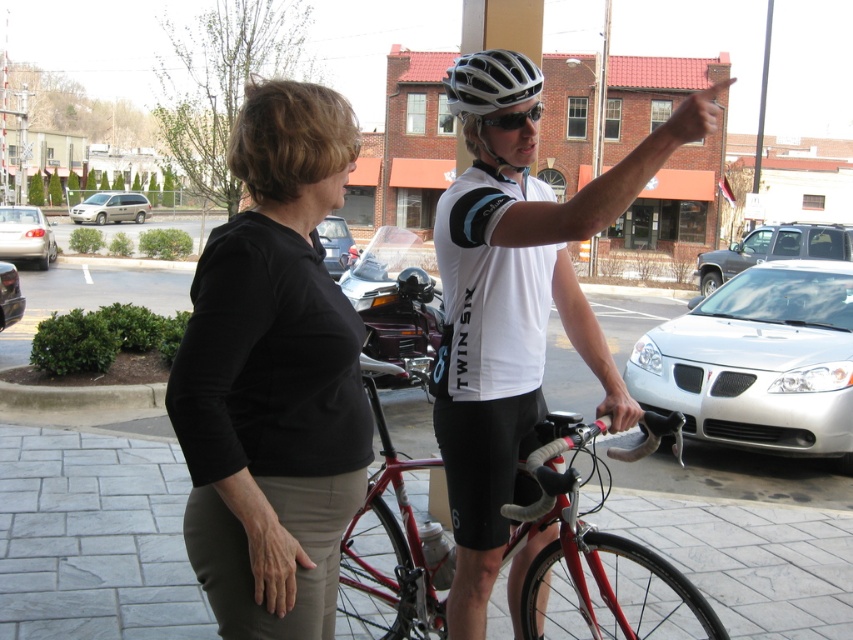
You are a delivery driver who needs to park your van in a spot that requires backing into the space. You see the metallic silver motorcycle at center and the beige matte minivan at left. Which vehicle should you avoid parking too close to the front of your van to prevent blocking the motorcycle?

You should avoid parking the beige matte minivan at left too close to the front of your van because the metallic silver motorcycle at center is positioned under it, meaning the minivan is overhead. Blocking the motorcycle would require not obstructing its space, so ensuring the van doesn

Based on the photo, you are a pedestrian standing at the center of the paved area. You need to cross to the other side. Which vehicle, the beige matte minivan at left or the metallic silver car at lower left, is closer to you?

The metallic silver car at lower left is closer to you because the beige matte minivan at left is positioned on the left side of it, meaning the metallic silver car is nearer to your current position at the center.